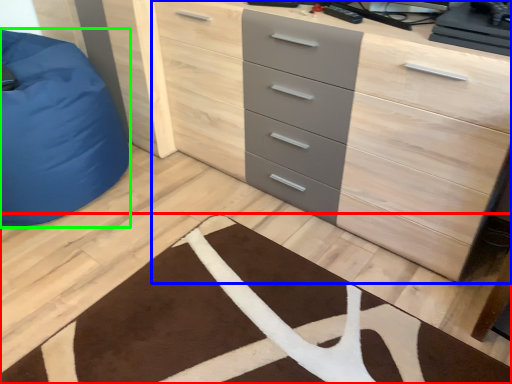
Question: Which is nearer to the doormat (highlighted by a red box)? chest of drawers (highlighted by a blue box) or furniture (highlighted by a green box).

Choices:
 (A) chest of drawers
 (B) furniture

Answer: (A)